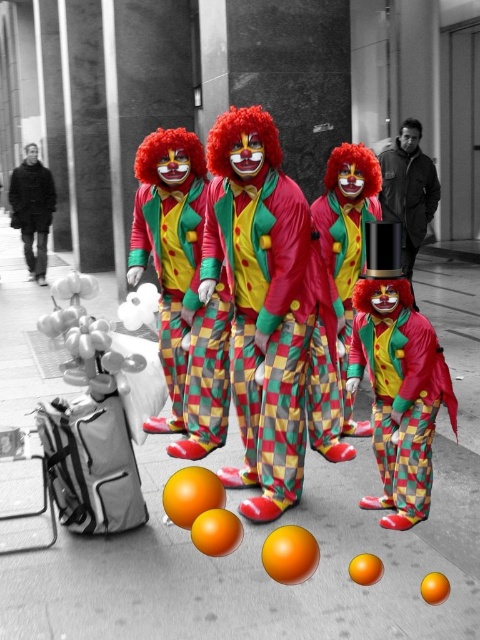
You are a delivery person who needs to place a large box on the ground. You see the smooth concrete pavement at center and the matte clown at center. Which surface is more suitable for placing the box?

The smooth concrete pavement at center has a larger size compared to the matte clown at center, so it is more suitable for placing the large box.

You are a delivery robot with a 1.2 meter wide package. You need to move through the area where the smooth concrete pavement at center and the matte clown at center are. Can you pass through the space between them?

The smooth concrete pavement at center might be wider than matte clown at center, so it is possible that there is enough space for the delivery robot with a 1.2 meter wide package to pass through, but the exact width is uncertain based on the provided information.

You are standing in the shopping mall and see the smooth concrete pavement at center and the matte clown at center. Which surface is closer to you?

The smooth concrete pavement at center is closer to the viewer than the matte clown at center.